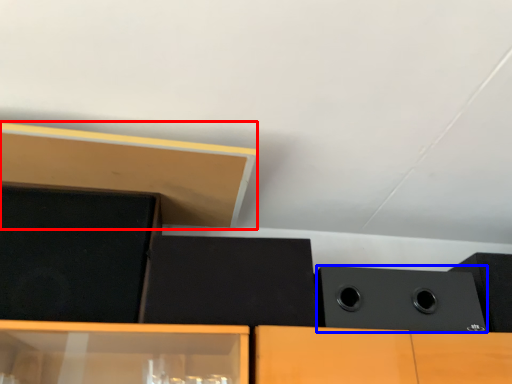
Question: Among these objects, which one is nearest to the camera, wood (highlighted by a red box) or speaker (highlighted by a blue box)?

Choices:
 (A) wood
 (B) speaker

Answer: (A)